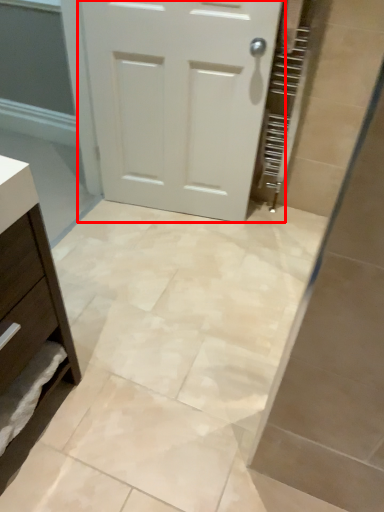
Question: From the image's perspective, what is the correct spatial relationship of door (annotated by the red box) in relation to chest of drawers?

Choices:
 (A) above
 (B) below

Answer: (A)